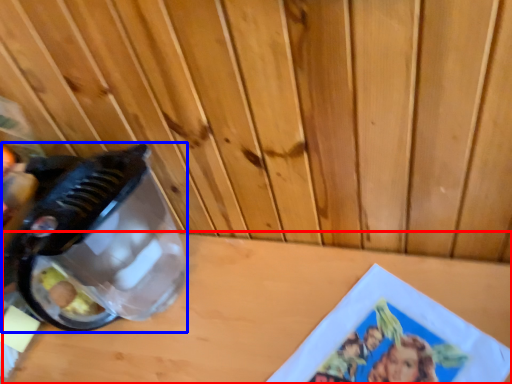
Question: Among these objects, which one is nearest to the camera, table top (highlighted by a red box) or appliance (highlighted by a blue box)?

Choices:
 (A) table top
 (B) appliance

Answer: (A)